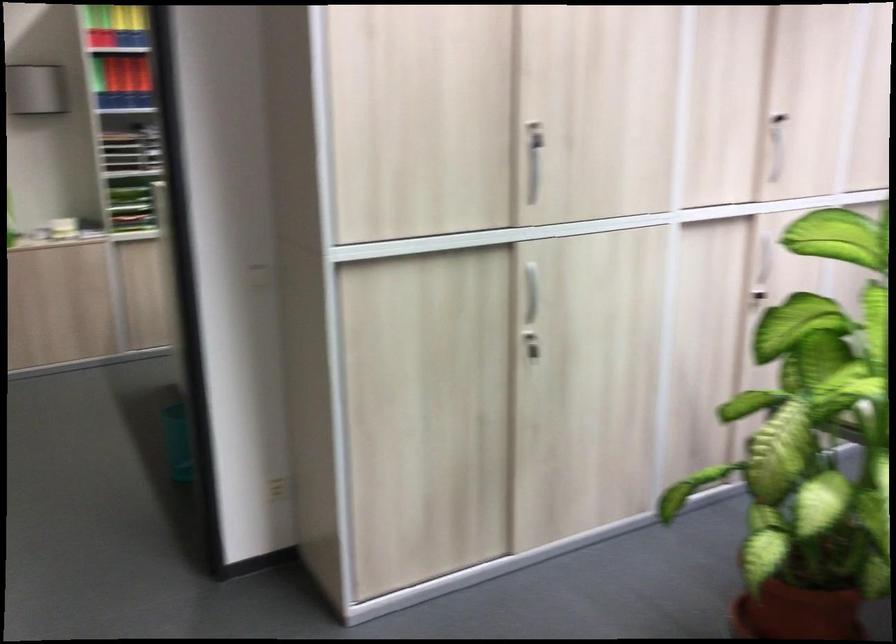
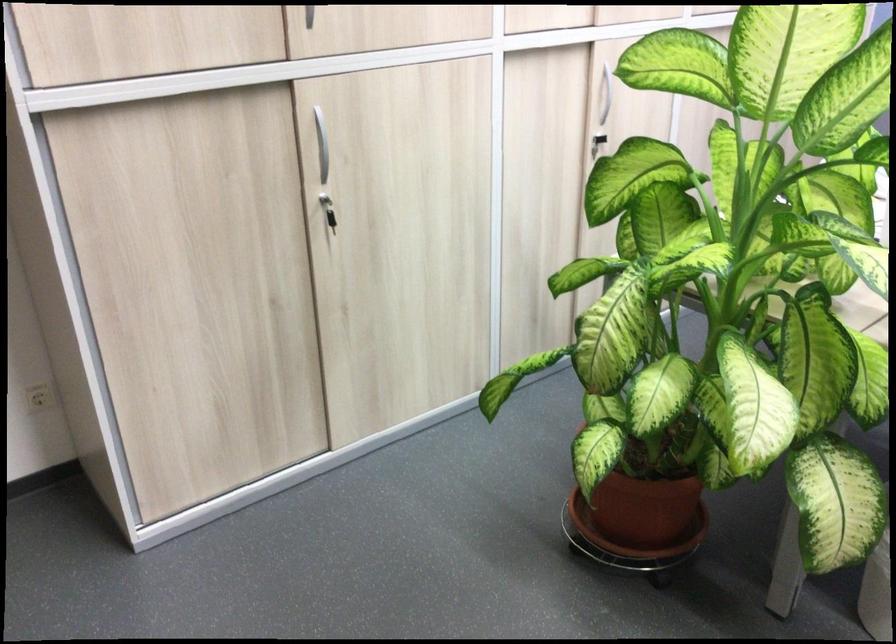
Where in the second image is the point corresponding to the point at 280,484 from the first image?

(39, 397)